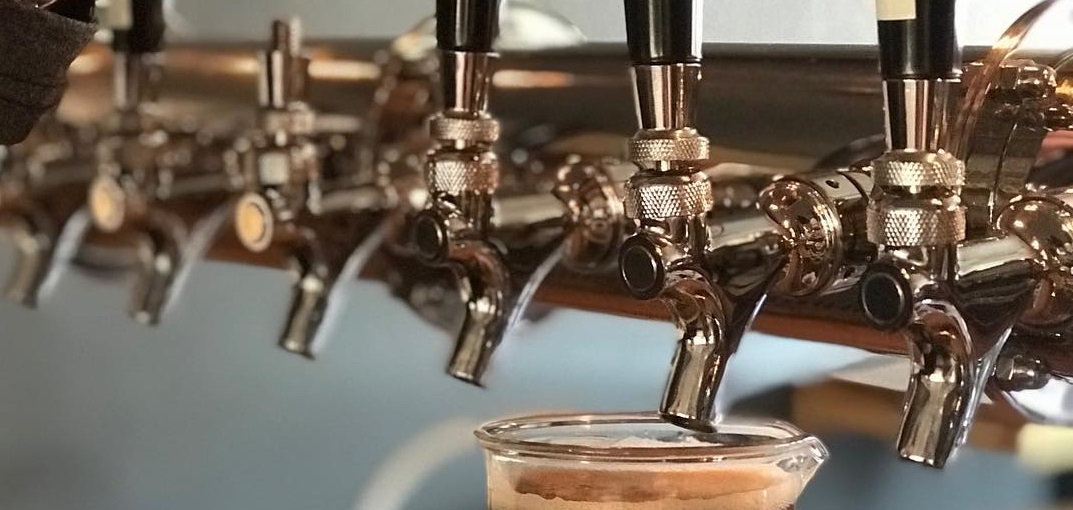
Identify the location of object in the corner. (61, 76), (48, 42), (32, 80), (29, 33).